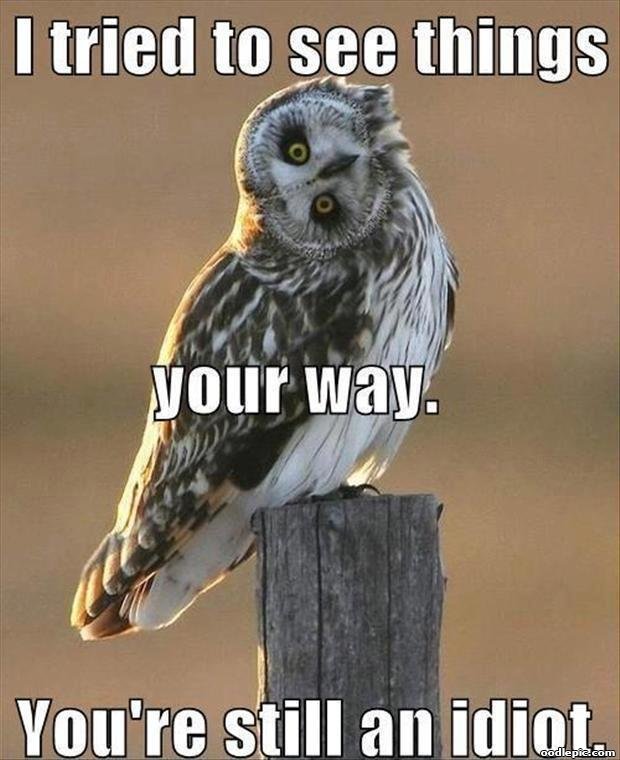
At what (x,y) coordinates should I click in order to perform the action: click on wood post. Please return your answer as a coordinate pair (x, y). Looking at the image, I should click on 366,613.